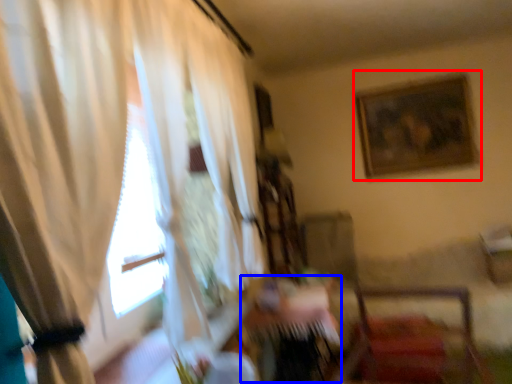
Question: Which object appears farthest to the camera in this image, picture frame (highlighted by a red box) or table (highlighted by a blue box)?

Choices:
 (A) picture frame
 (B) table

Answer: (A)